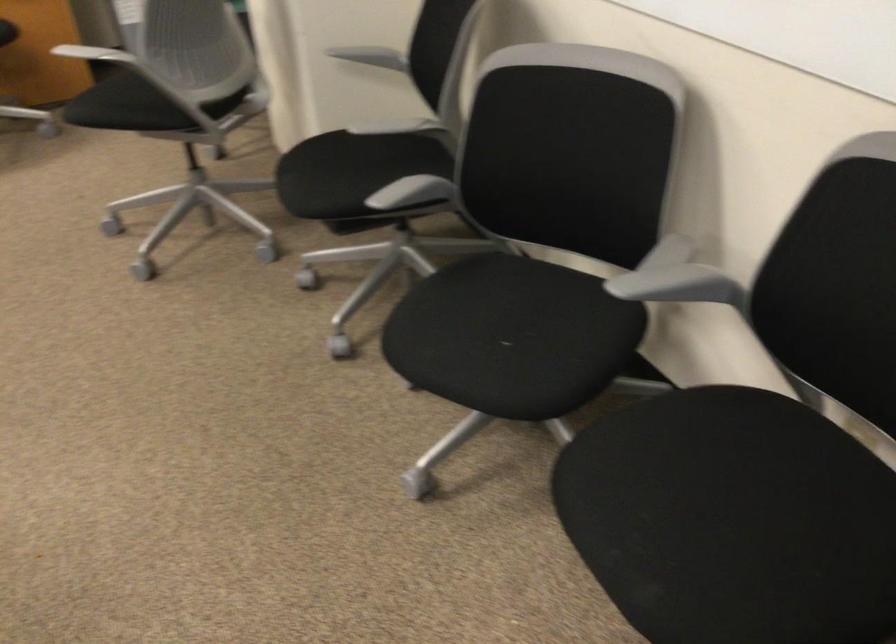
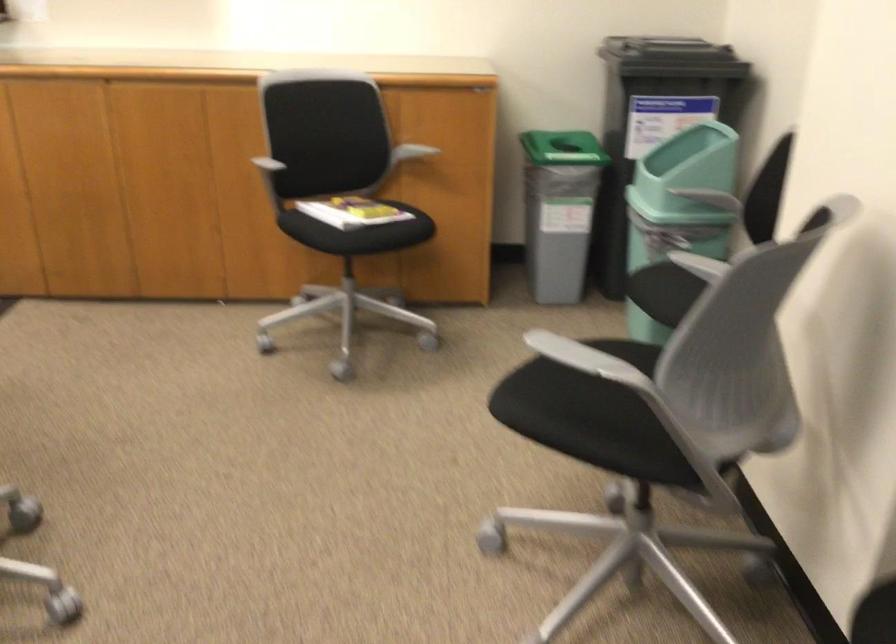
In the scene shown: Which direction would the cameraman need to move to produce the second image?

The movement direction of the cameraman is left, forward.